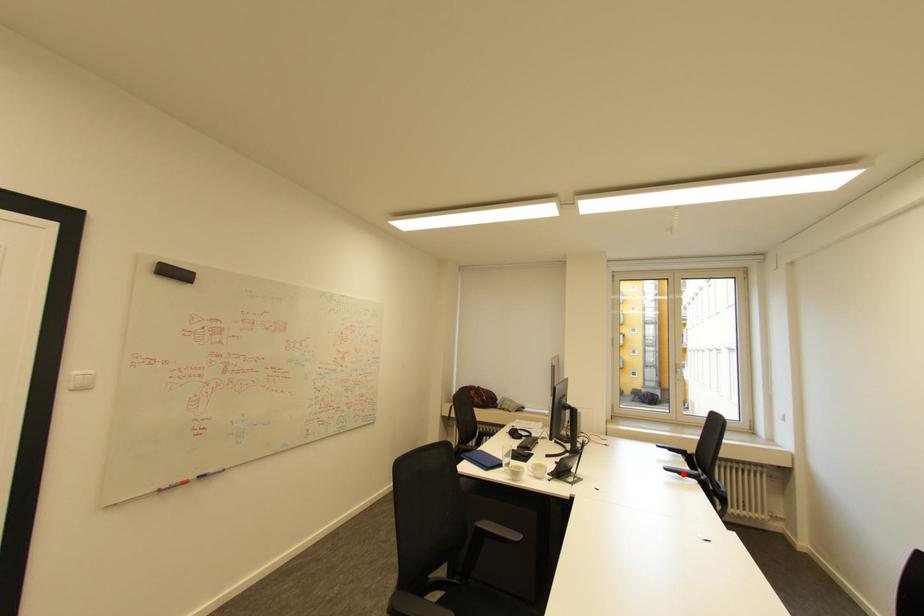
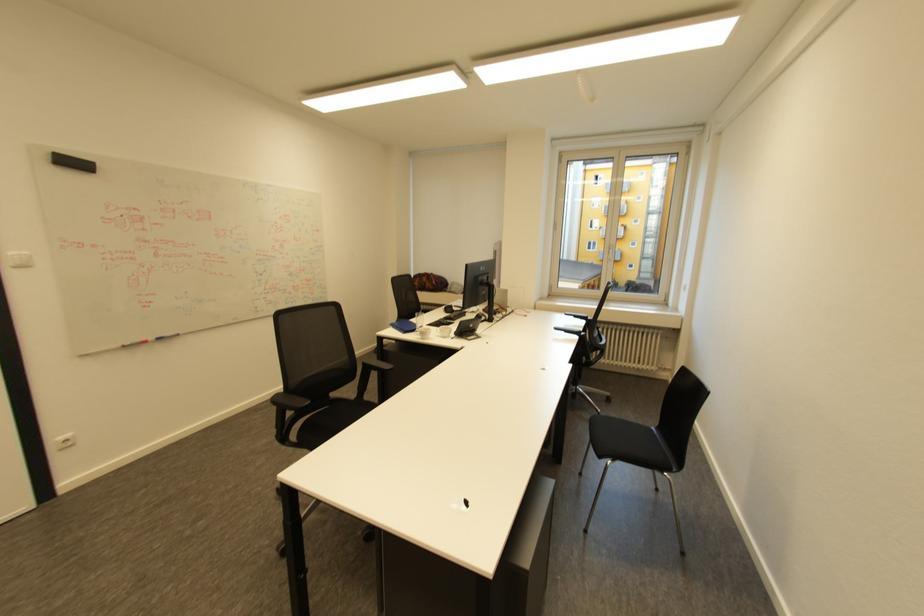
The point at the highlighted location is marked in the first image. Where is the corresponding point in the second image?

(570, 333)